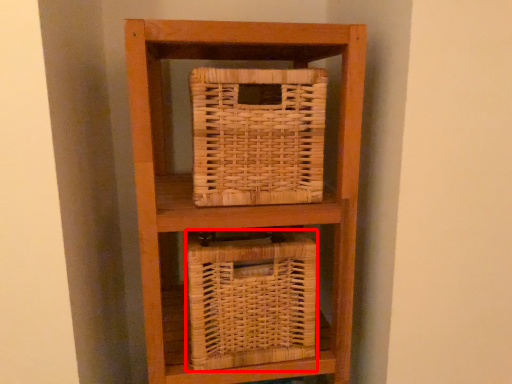
Question: From the image's perspective, considering the relative positions of basket (annotated by the red box) and basket in the image provided, where is basket (annotated by the red box) located with respect to the staircase?

Choices:
 (A) below
 (B) above

Answer: (A)